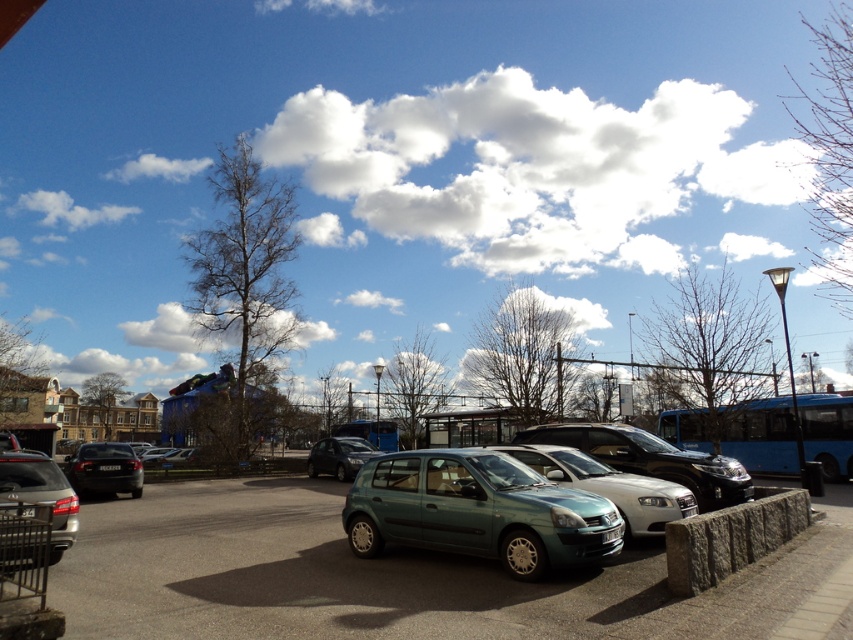
Question: Does teal matte hatchback at center have a larger size compared to blue metallic bus at right?

Choices:
 (A) no
 (B) yes

Answer: (B)

Question: Based on their relative distances, which object is nearer to the blue metallic bus at right?

Choices:
 (A) matte black car at left
 (B) metallic teal hatchback at center

Answer: (B)

Question: Can you confirm if metallic teal hatchback at center is positioned above blue matte bus at center?

Choices:
 (A) yes
 (B) no

Answer: (A)

Question: Which of the following is the farthest from the observer?

Choices:
 (A) matte black car at left
 (B) metallic silver hatchback at center
 (C) blue metallic bus at right
 (D) metallic green hatchback at center

Answer: (A)

Question: Which object is farther from the camera taking this photo?

Choices:
 (A) teal matte hatchback at center
 (B) matte black car at left

Answer: (B)

Question: In this image, where is blue metallic bus at right located relative to matte gray suv at lower left?

Choices:
 (A) left
 (B) right

Answer: (B)